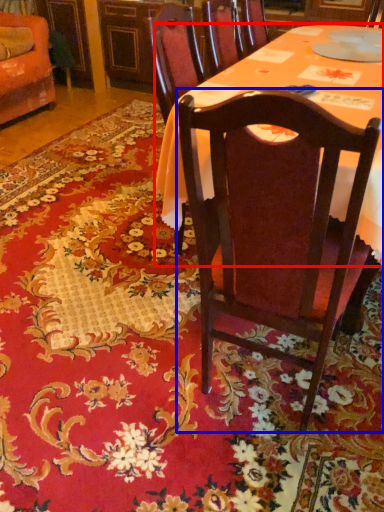
Question: Among these objects, which one is farthest to the camera, desk (highlighted by a red box) or chair (highlighted by a blue box)?

Choices:
 (A) desk
 (B) chair

Answer: (A)